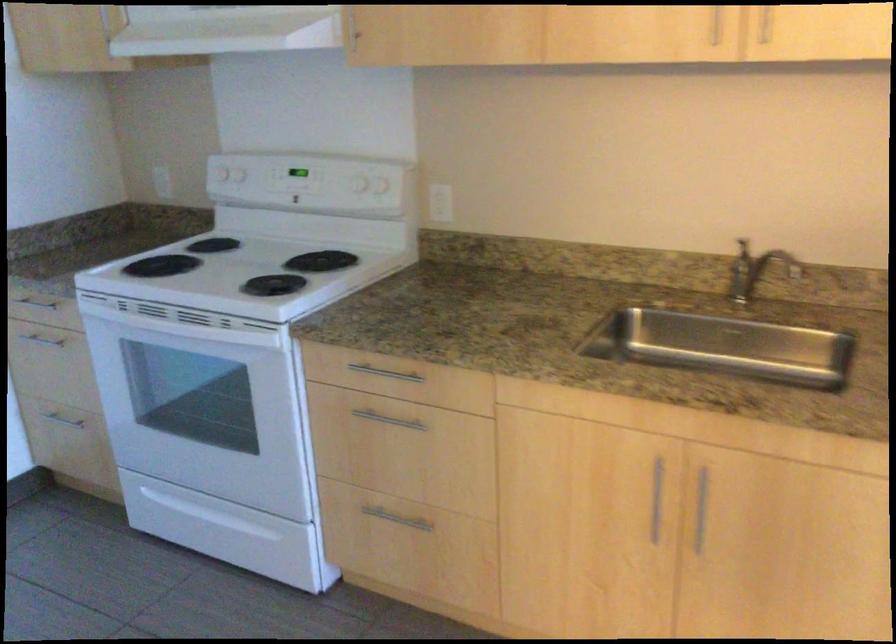
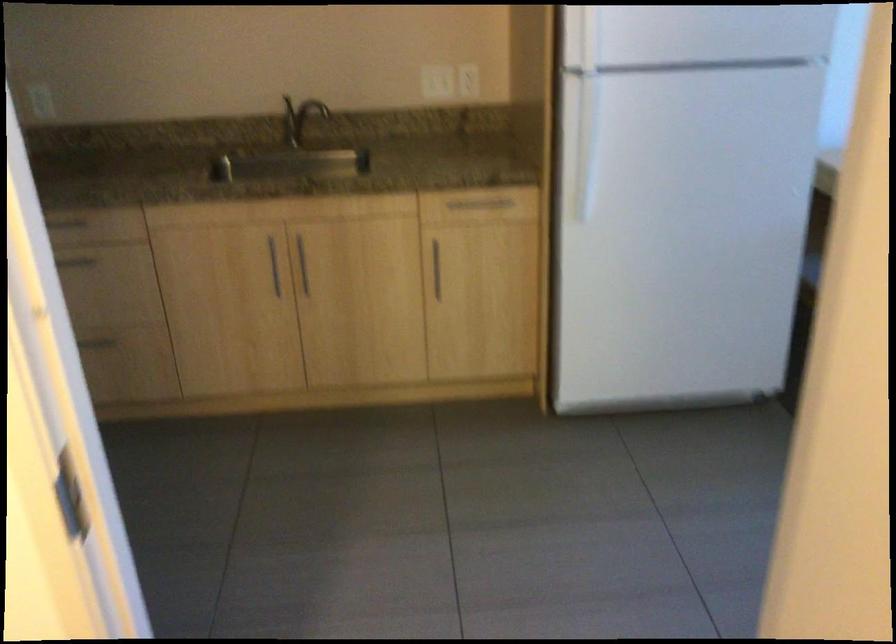
Find the pixel in the second image that matches (x=658, y=489) in the first image.

(273, 265)